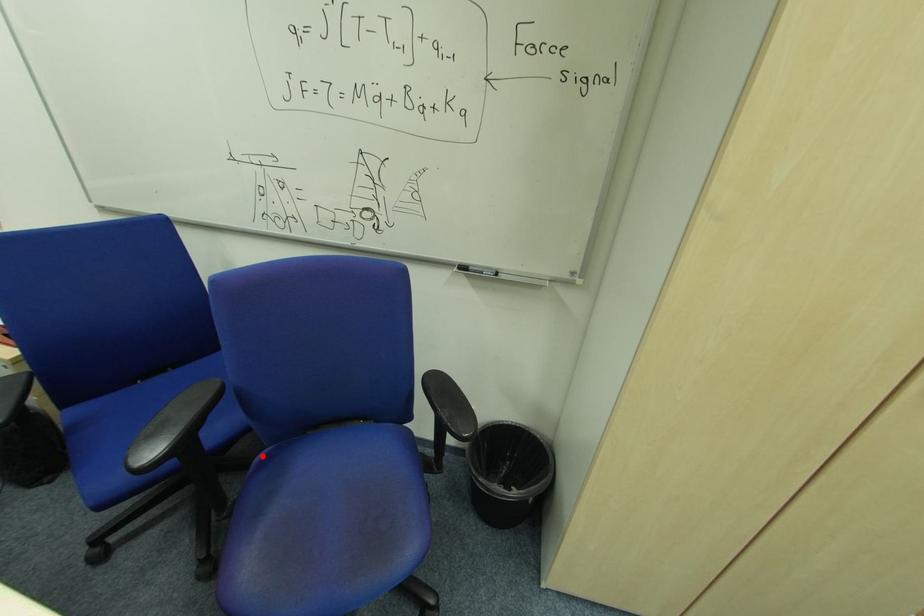
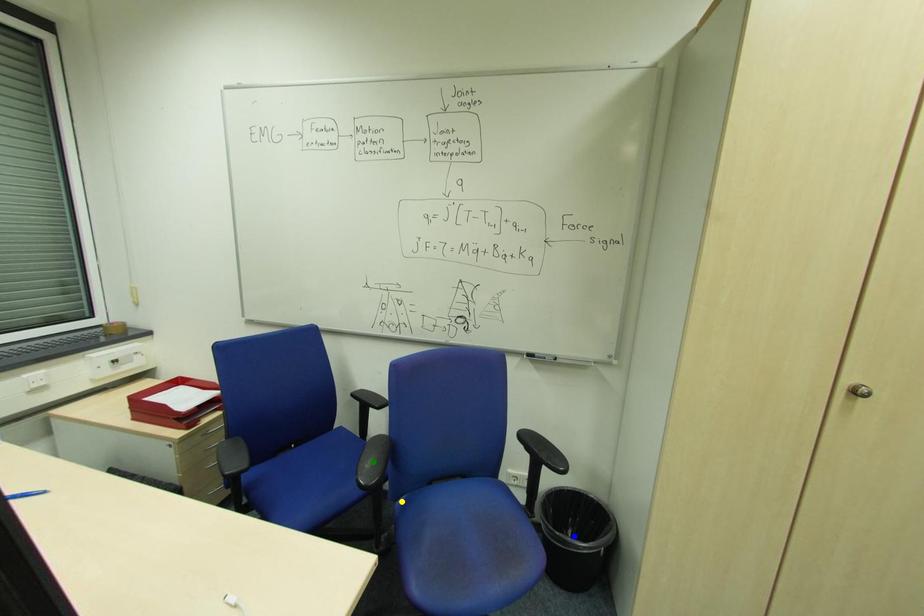
Question: I am providing you with two images of the same scene from different viewpoints. A red point is marked on the first image. You are given multiple points on the second image. Can you choose the point in image 2 that corresponds to the point in image 1?

Choices:
 (A) green point
 (B) blue point
 (C) yellow point

Answer: (C)